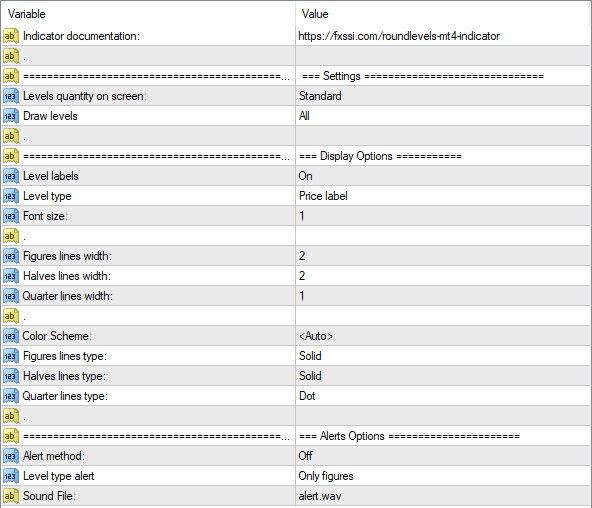
You are a GUI agent. You are given a task and a screenshot of the screen. Output one action in this format:
    pyautogui.click(x=<x>, y=<y>)
    Task: Click on the letter sticky note graphics
    The image size is (592, 508).
    Given the screenshot: What is the action you would take?
    pyautogui.click(x=9, y=492), pyautogui.click(x=8, y=430), pyautogui.click(x=9, y=415), pyautogui.click(x=12, y=315), pyautogui.click(x=8, y=236), pyautogui.click(x=5, y=156), pyautogui.click(x=9, y=136), pyautogui.click(x=7, y=74), pyautogui.click(x=8, y=55), pyautogui.click(x=7, y=34)